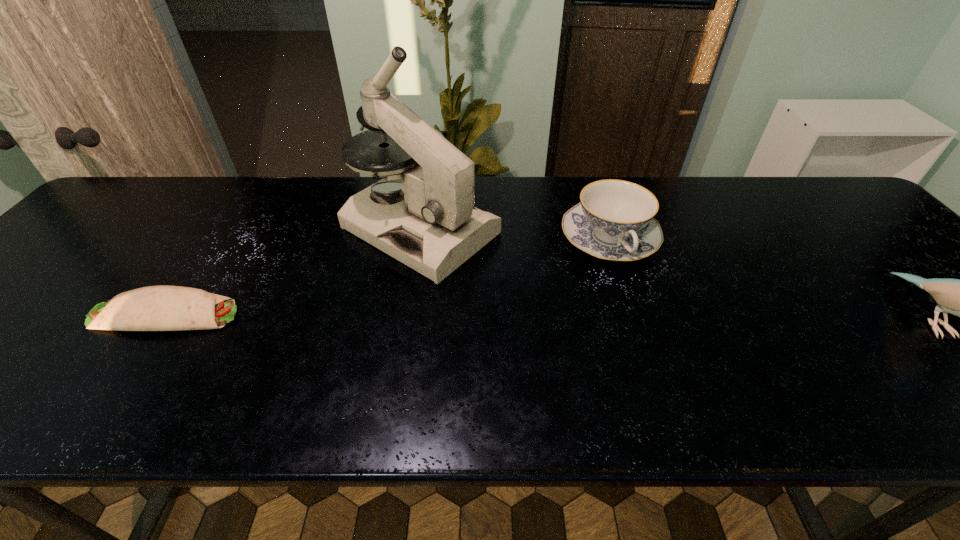
Where is `the shortest object`? the shortest object is located at coordinates (154, 308).

Identify the location of the leftmost object. (154, 308).

Find the location of a particular element. The width and height of the screenshot is (960, 540). microscope is located at coordinates (432, 226).

Where is `the tallest object`? This screenshot has height=540, width=960. the tallest object is located at coordinates pyautogui.click(x=432, y=226).

Identify the location of the third object from left to right. (614, 221).

The image size is (960, 540). What are the coordinates of `the third tallest object` in the screenshot? It's located at coord(614,221).

Find the location of a particular element. The width and height of the screenshot is (960, 540). free point located 0.370m at the bitten end of the shortest object is located at coordinates (407, 315).

At what (x,y) coordinates should I click in order to perform the action: click on free location located 0.370m at the eyepiece of the third object from right to left. Please return your answer as a coordinate pair (x, y). Image resolution: width=960 pixels, height=540 pixels. Looking at the image, I should click on (621, 334).

The width and height of the screenshot is (960, 540). I want to click on blank area located 0.320m at the eyepiece of the third object from right to left, so click(600, 323).

Where is `vacant point located 0.110m at the eyepiece of the third object from right to left`? This screenshot has height=540, width=960. vacant point located 0.110m at the eyepiece of the third object from right to left is located at coordinates (520, 281).